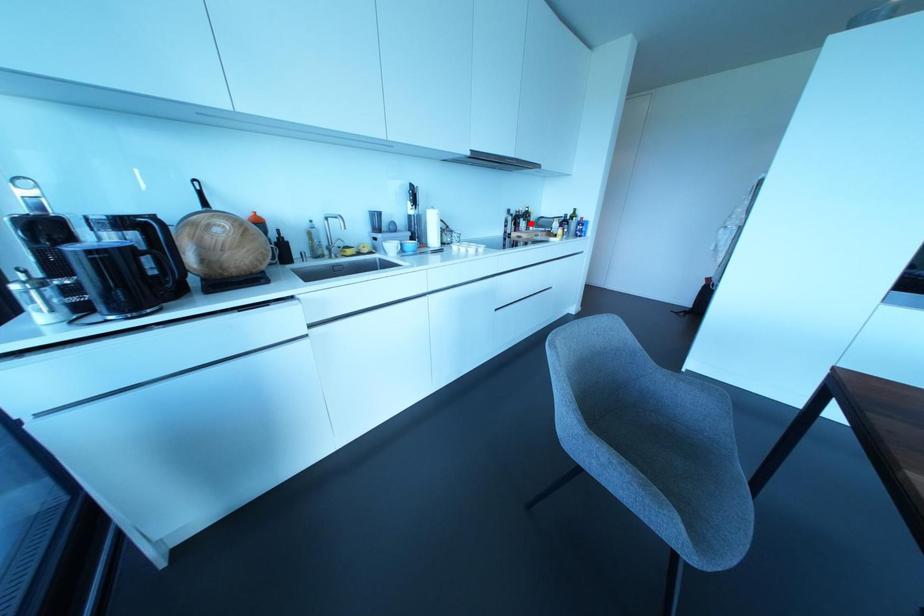
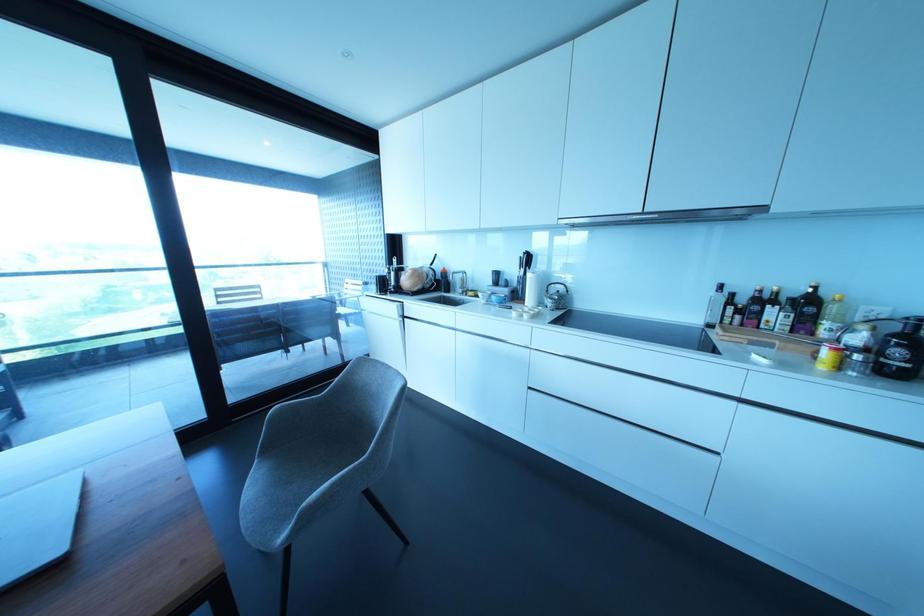
In the second image, find the point that corresponds to the highlighted location in the first image.

(825, 323)